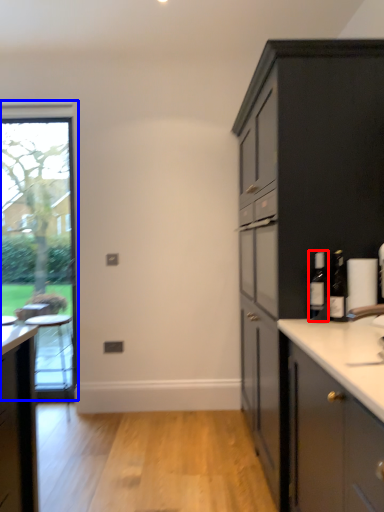
Question: Which of the following is the closest to the observer, bottle (highlighted by a red box) or window (highlighted by a blue box)?

Choices:
 (A) bottle
 (B) window

Answer: (A)